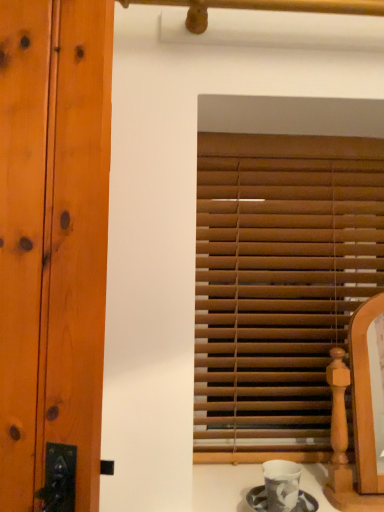
Question: Considering the positions of point (299, 240) and point (276, 500), is point (299, 240) closer or farther from the camera than point (276, 500)?

Choices:
 (A) closer
 (B) farther

Answer: (B)

Question: Which is correct: wooden blinds at center is inside porcelain cup at lower center, or outside of it?

Choices:
 (A) inside
 (B) outside

Answer: (B)

Question: Looking at their shapes, would you say wooden blinds at center is wider or thinner than porcelain cup at lower center?

Choices:
 (A) wide
 (B) thin

Answer: (B)

Question: Visually, is porcelain cup at lower center positioned to the left or to the right of wooden blinds at center?

Choices:
 (A) right
 (B) left

Answer: (B)

Question: Is porcelain cup at lower center in front of or behind wooden blinds at center in the image?

Choices:
 (A) behind
 (B) front

Answer: (B)

Question: From a real-world perspective, is porcelain cup at lower center above or below wooden blinds at center?

Choices:
 (A) above
 (B) below

Answer: (B)

Question: From the image's perspective, relative to wooden blinds at center, is porcelain cup at lower center above or below?

Choices:
 (A) below
 (B) above

Answer: (A)